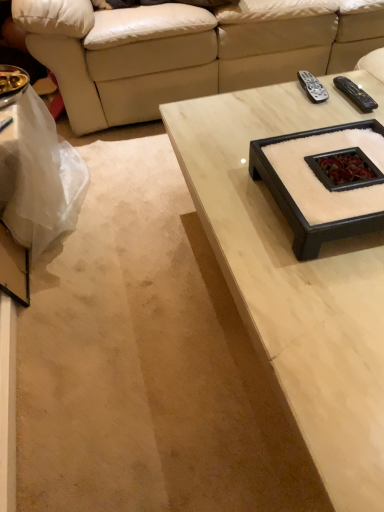
Question: From the image's perspective, is black plastic remote at upper right, acting as the 2th remote starting from the left, positioned above or below white plastic bag at lower left?

Choices:
 (A) below
 (B) above

Answer: (B)

Question: In the image, is black plastic remote at upper right, acting as the 2th remote starting from the left, positioned in front of or behind white plastic bag at lower left?

Choices:
 (A) behind
 (B) front

Answer: (A)

Question: Which object is the farthest from the white marble coffee table at upper center?

Choices:
 (A) beige leather couch at upper center
 (B) black plastic remote at upper right, acting as the 2th remote starting from the left
 (C) white plastic bag at lower left
 (D) black plastic remote at upper right, arranged as the second remote when viewed from the right

Answer: (A)

Question: Which object is positioned closest to the black plastic remote at upper right, arranged as the 1th remote when viewed from the right?

Choices:
 (A) white marble coffee table at upper center
 (B) beige leather couch at upper center
 (C) black plastic remote at upper right, placed as the 1th remote when sorted from left to right
 (D) white plastic bag at lower left

Answer: (C)